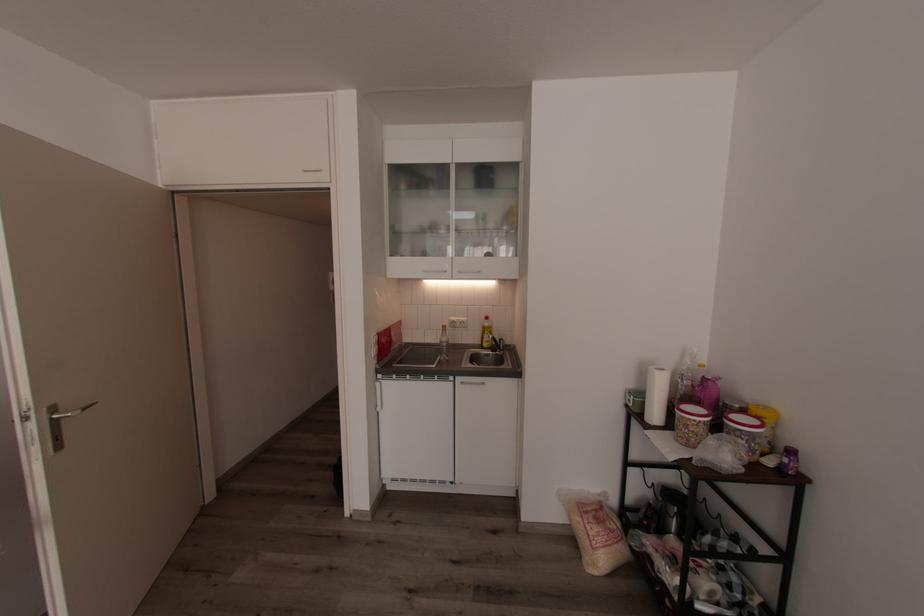
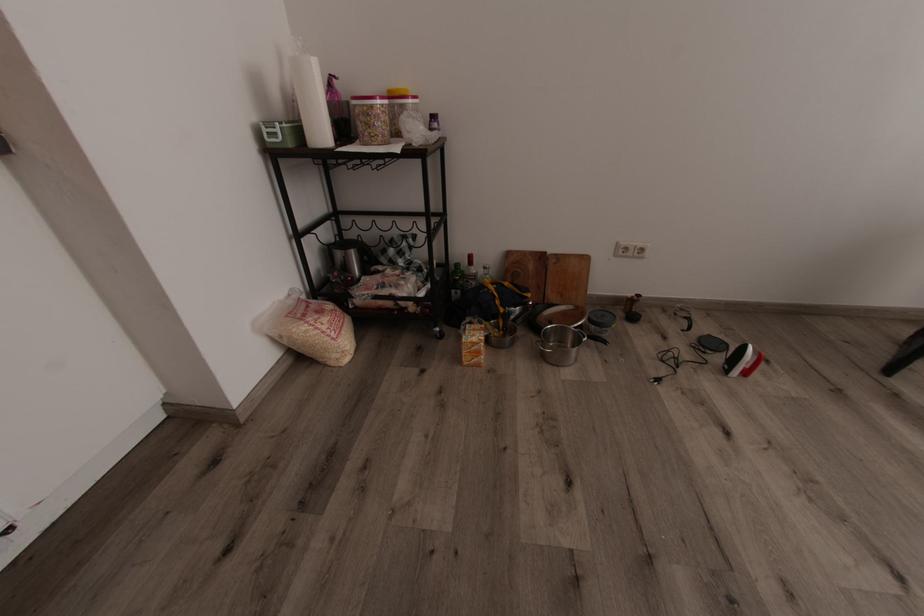
In the second image, find the point that corresponds to (x=698, y=431) in the first image.

(388, 121)